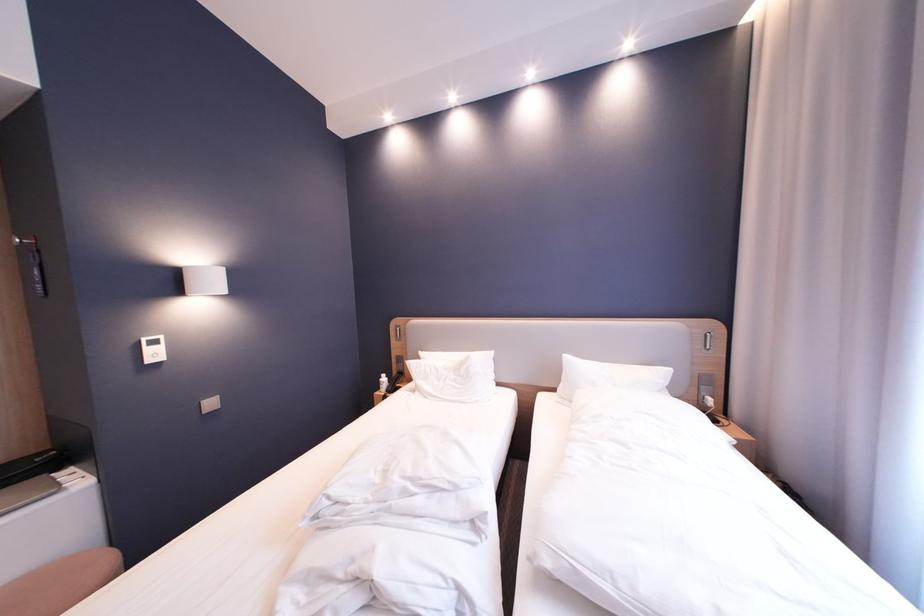
Find where to plugg the silver power outlet. Please return your answer as a coordinate pair (x, y).

(706, 390)